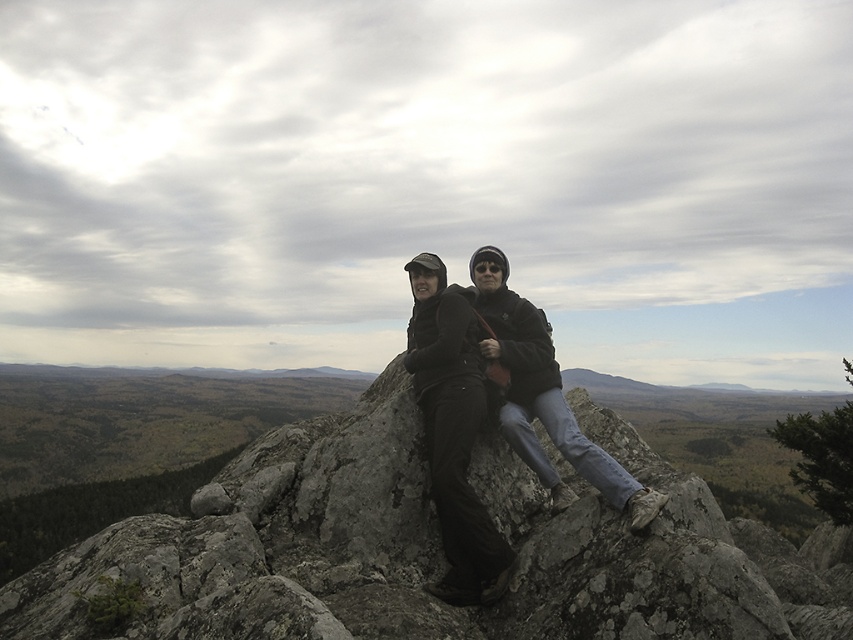
Which is above, gray rock at center or matte black jacket at center?

matte black jacket at center is above.

You are a GUI agent. You are given a task and a screenshot of the screen. Output one action in this format:
    pyautogui.click(x=<x>, y=<y>)
    Task: Click on the gray rock at center
    
    Given the screenshot: What is the action you would take?
    pyautogui.click(x=425, y=552)